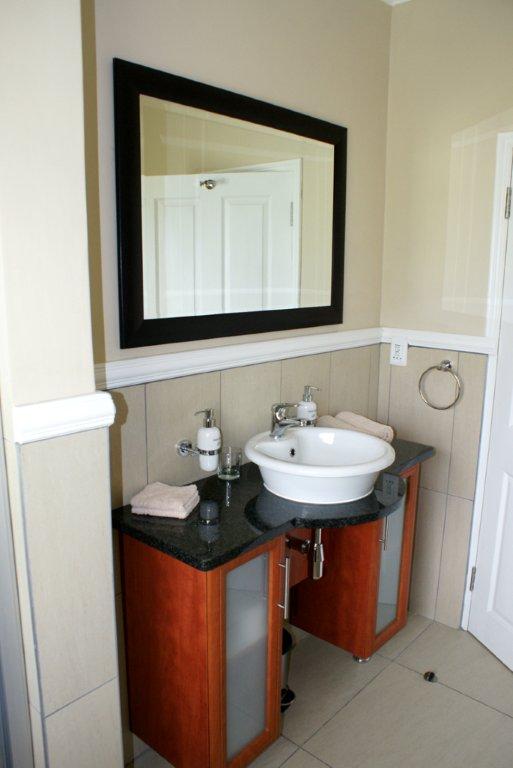
Find the location of a particular element. towel is located at coordinates (159, 505), (164, 514).